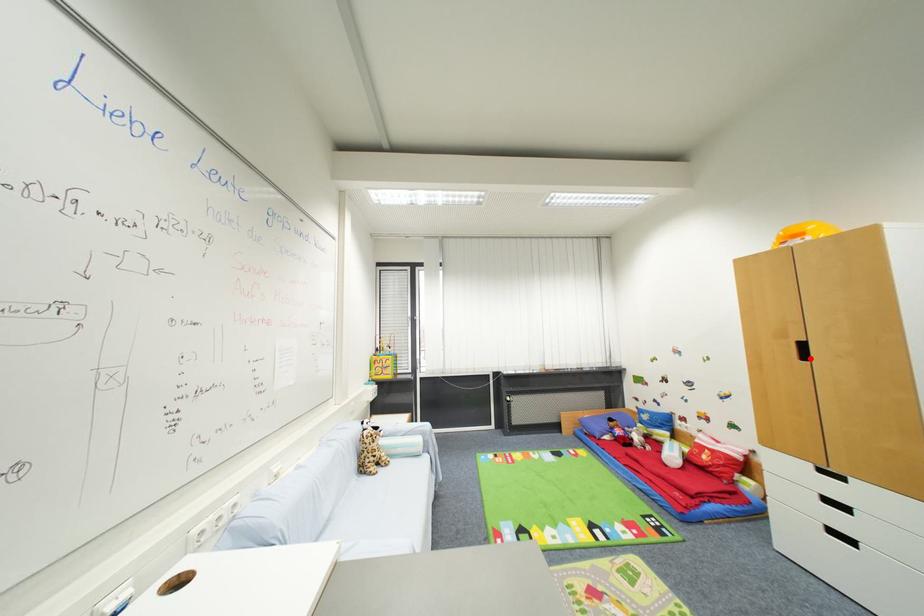
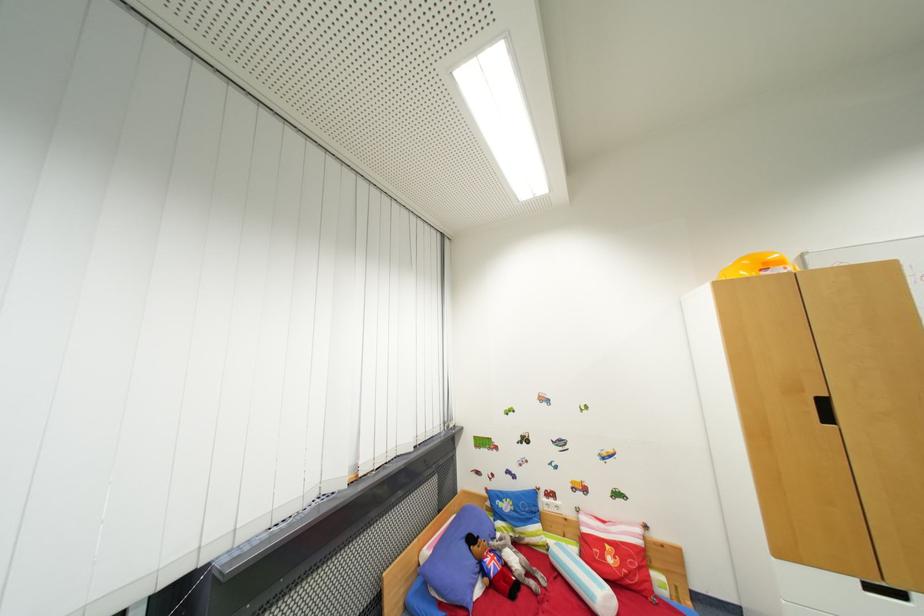
Question: I am providing you with two images of the same scene from different viewpoints. A red point is shown in image1. For the corresponding object point in image2, is it positioned nearer or farther from the camera?

Choices:
 (A) Nearer
 (B) Farther

Answer: (A)